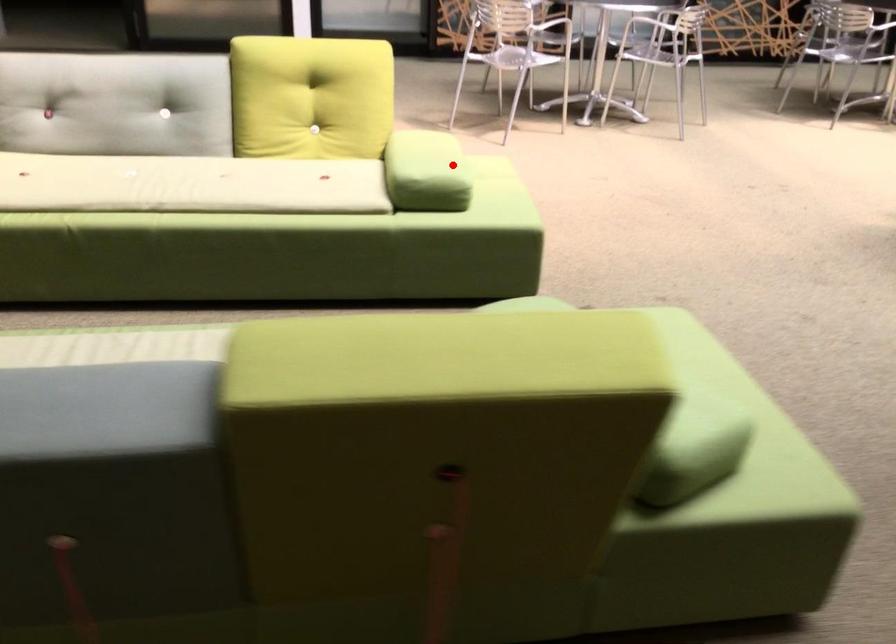
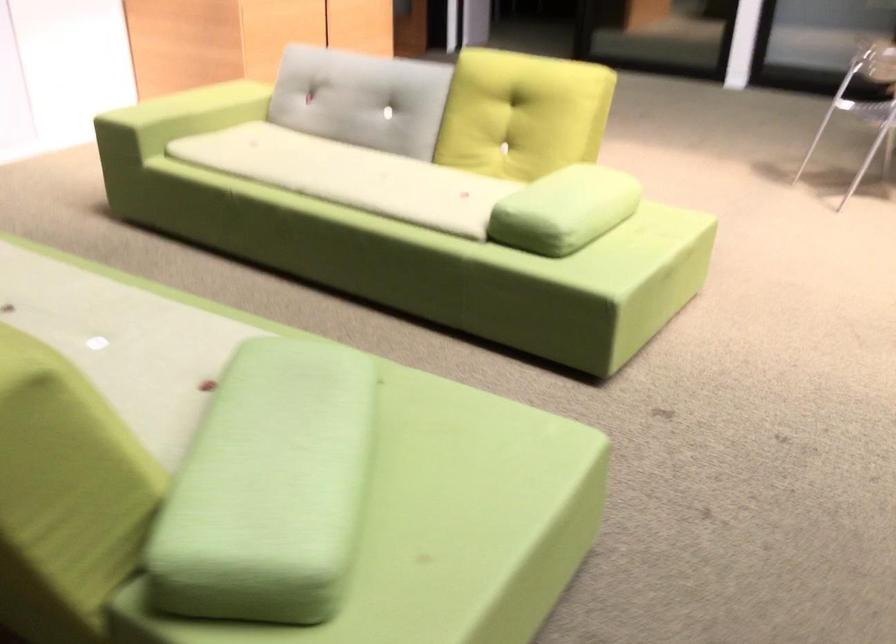
Locate, in the second image, the point that corresponds to the highlighted location in the first image.

(564, 210)